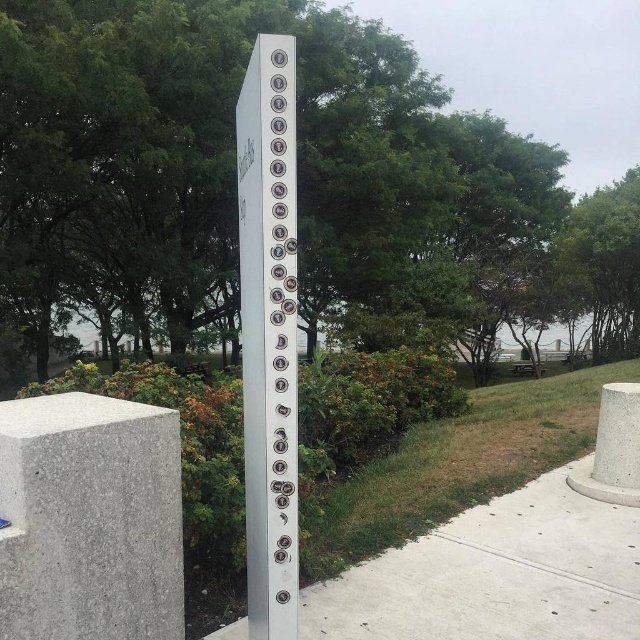
Is gray concrete at lower left taller than silver metallic pole at center?

No.

Does gray concrete at lower left have a lesser width compared to silver metallic pole at center?

In fact, gray concrete at lower left might be wider than silver metallic pole at center.

Find the location of a particular element. gray concrete at lower left is located at coordinates (90, 518).

Can you confirm if gray concrete at lower left is shorter than gray concrete pavement at center?

In fact, gray concrete at lower left may be taller than gray concrete pavement at center.

Between gray concrete at lower left and gray concrete pavement at center, which one is positioned lower?

gray concrete pavement at center

What do you see at coordinates (90, 518) in the screenshot?
I see `gray concrete at lower left` at bounding box center [90, 518].

Locate an element on the screen. The height and width of the screenshot is (640, 640). gray concrete at lower left is located at coordinates (90, 518).

Does point (410, 621) come closer to viewer compared to point (292, 336)?

No, it is not.

Is gray concrete pavement at center smaller than silver metallic pole at center?

Incorrect, gray concrete pavement at center is not smaller in size than silver metallic pole at center.

In order to click on gray concrete pavement at center in this screenshot , I will do `click(496, 573)`.